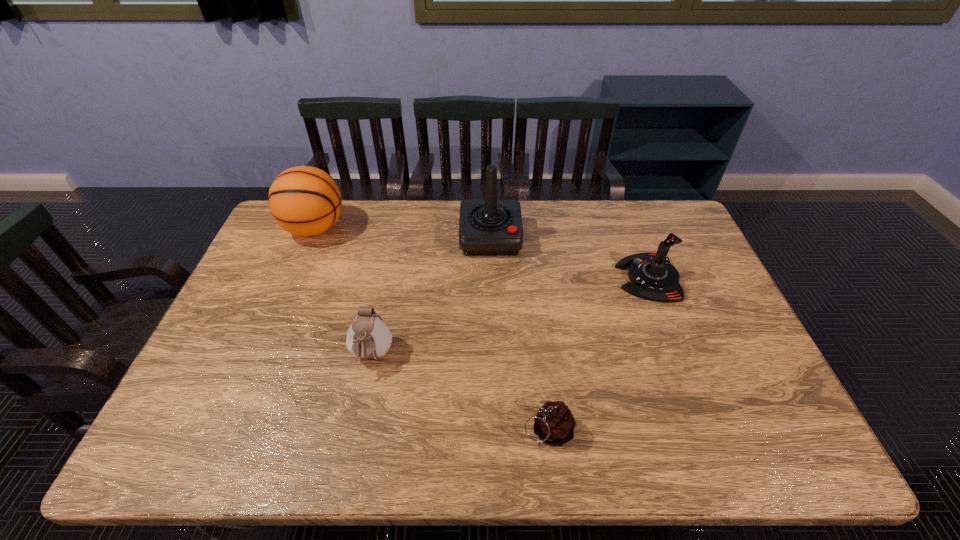
Where is `basketball that is positioned at the far edge`? This screenshot has height=540, width=960. basketball that is positioned at the far edge is located at coordinates (304, 200).

Where is `object located at the near edge`? The width and height of the screenshot is (960, 540). object located at the near edge is located at coordinates (554, 424).

Find the location of a particular element. This screenshot has width=960, height=540. object present at the left edge is located at coordinates pos(304,200).

The width and height of the screenshot is (960, 540). Identify the location of object that is at the right edge. (653, 277).

You are a GUI agent. You are given a task and a screenshot of the screen. Output one action in this format:
    pyautogui.click(x=<x>, y=<y>)
    Task: Click on the object that is at the far left corner
    This screenshot has width=960, height=540.
    Given the screenshot: What is the action you would take?
    pyautogui.click(x=304, y=200)

Locate an element on the screen. free space at the far edge of the desktop is located at coordinates (433, 237).

Locate an element on the screen. This screenshot has width=960, height=540. vacant space at the near edge of the desktop is located at coordinates (399, 457).

You are a GUI agent. You are given a task and a screenshot of the screen. Output one action in this format:
    pyautogui.click(x=<x>, y=<y>)
    Task: Click on the vacant area at the left edge
    
    Given the screenshot: What is the action you would take?
    pyautogui.click(x=237, y=347)

In the image, there is a desktop. Identify the location of free space at the right edge. (684, 302).

Image resolution: width=960 pixels, height=540 pixels. I want to click on vacant region at the far right corner, so click(663, 210).